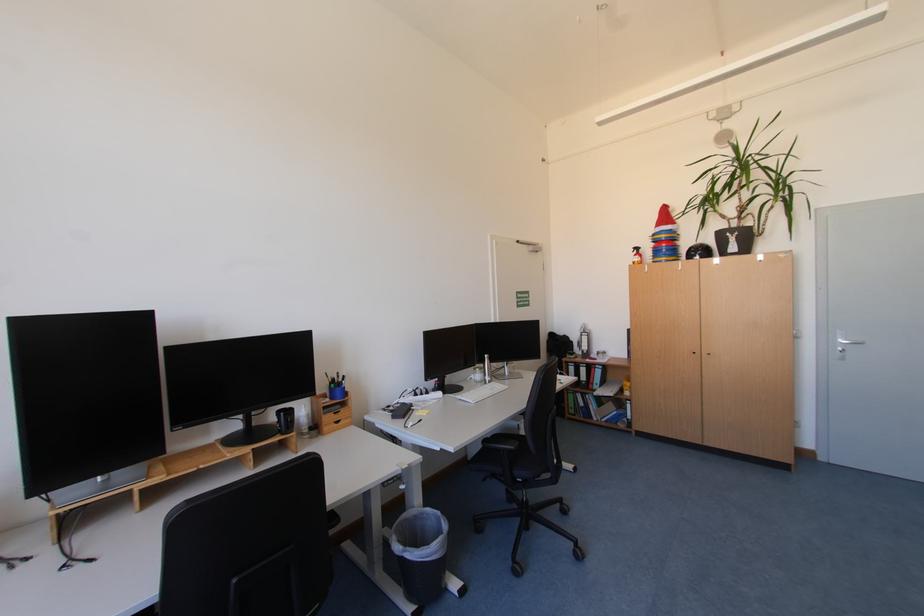
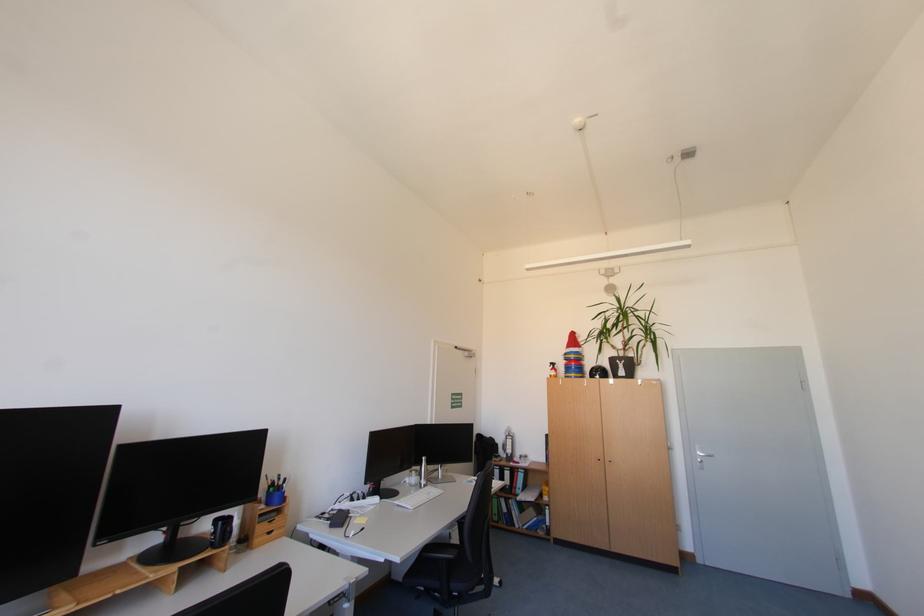
In a continuous first-person perspective shot, in which direction is the camera moving?

The cameraman walked toward left, backward.